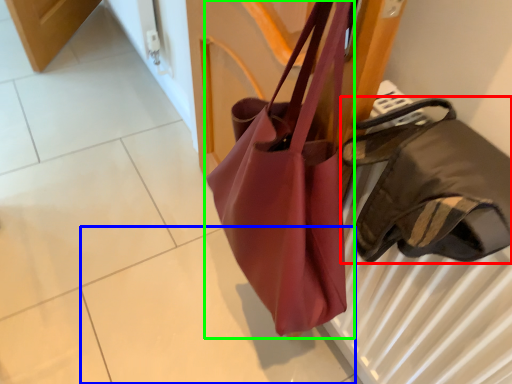
Question: Estimate the real-world distances between objects in this image. Which object is farther from handbag (highlighted by a red box), tile (highlighted by a blue box) or handbag (highlighted by a green box)?

Choices:
 (A) tile
 (B) handbag

Answer: (A)